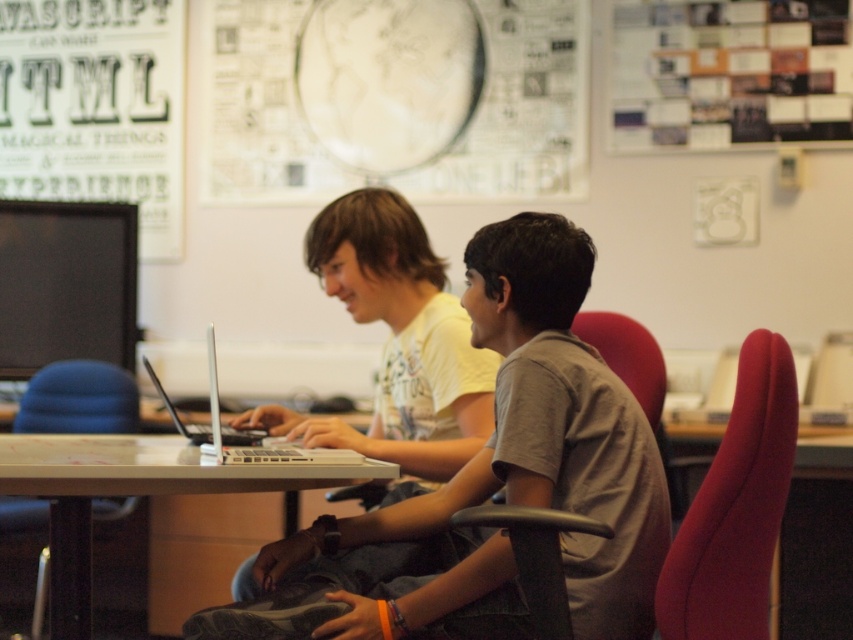
Is velvet-like red swivel chair at right thinner than white glossy table at center?

Correct, velvet-like red swivel chair at right's width is less than white glossy table at center's.

Which is below, velvet-like red swivel chair at right or white glossy table at center?

white glossy table at center

Describe the element at coordinates (735, 508) in the screenshot. The height and width of the screenshot is (640, 853). I see `velvet-like red swivel chair at right` at that location.

Identify the location of velvet-like red swivel chair at right. This screenshot has height=640, width=853. (735, 508).

Can you confirm if light brown shirt at center is positioned above white glossy table at center?

Yes, light brown shirt at center is above white glossy table at center.

At what (x,y) coordinates should I click in order to perform the action: click on light brown shirt at center. Please return your answer as a coordinate pair (x, y). This screenshot has height=640, width=853. Looking at the image, I should click on (489, 484).

You are a GUI agent. You are given a task and a screenshot of the screen. Output one action in this format:
    pyautogui.click(x=<x>, y=<y>)
    Task: Click on the light brown shirt at center
    This screenshot has width=853, height=640.
    Given the screenshot: What is the action you would take?
    pyautogui.click(x=489, y=484)

Is the position of velvet-like red swivel chair at right less distant than that of blue fabric chair at lower left?

Yes, velvet-like red swivel chair at right is closer to the viewer.

Between velvet-like red swivel chair at right and blue fabric chair at lower left, which one appears on the left side from the viewer's perspective?

blue fabric chair at lower left

Describe the element at coordinates (735, 508) in the screenshot. I see `velvet-like red swivel chair at right` at that location.

Image resolution: width=853 pixels, height=640 pixels. Identify the location of velvet-like red swivel chair at right. (735, 508).